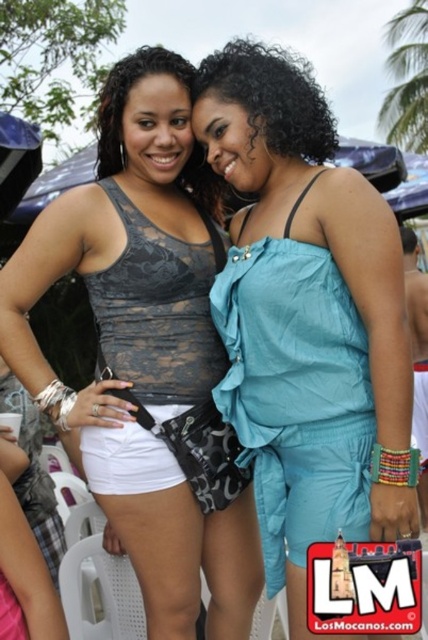
You are a fashion designer observing two outfits in the image. The teal satin jumpsuit at center and the matte black tank top at center. Which outfit has a shorter length?

The teal satin jumpsuit at center is shorter than the matte black tank top at center.

In the scene shown: You are a fashion designer analyzing the outfits in the image. You need to determine which clothing item takes up more visual space in the composition. Which of the two items, the teal satin jumpsuit at center or the matte black tank top at center, is larger in size?

The matte black tank top at center is larger than the teal satin jumpsuit at center, so it takes up more visual space in the composition.

You are a photographer setting up for a photoshoot and need to ensure that both the teal satin jumpsuit at center and the matte black tank top at center are visible in the frame. Given their positions, which clothing item should you focus on first to ensure proper framing?

The teal satin jumpsuit at center is located above the matte black tank top at center, so you should focus on framing the teal satin jumpsuit at center first to ensure both items are captured in the shot.